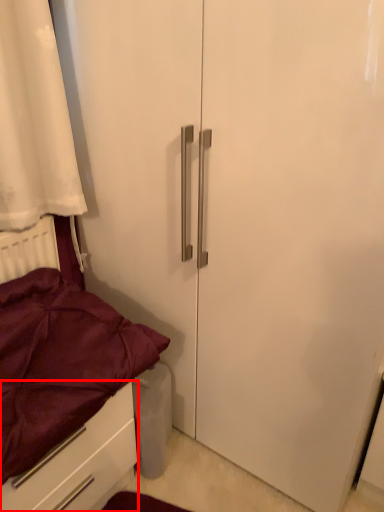
Question: From the image's perspective, considering the relative positions of drawer (annotated by the red box) and bed in the image provided, where is drawer (annotated by the red box) located with respect to the staircase?

Choices:
 (A) below
 (B) above

Answer: (A)